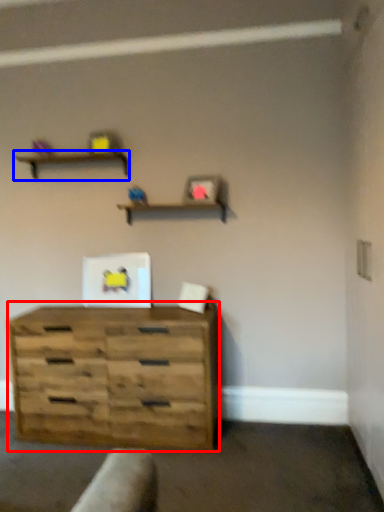
Question: Which object appears farthest to the camera in this image, chest of drawers (highlighted by a red box) or shelf (highlighted by a blue box)?

Choices:
 (A) chest of drawers
 (B) shelf

Answer: (B)